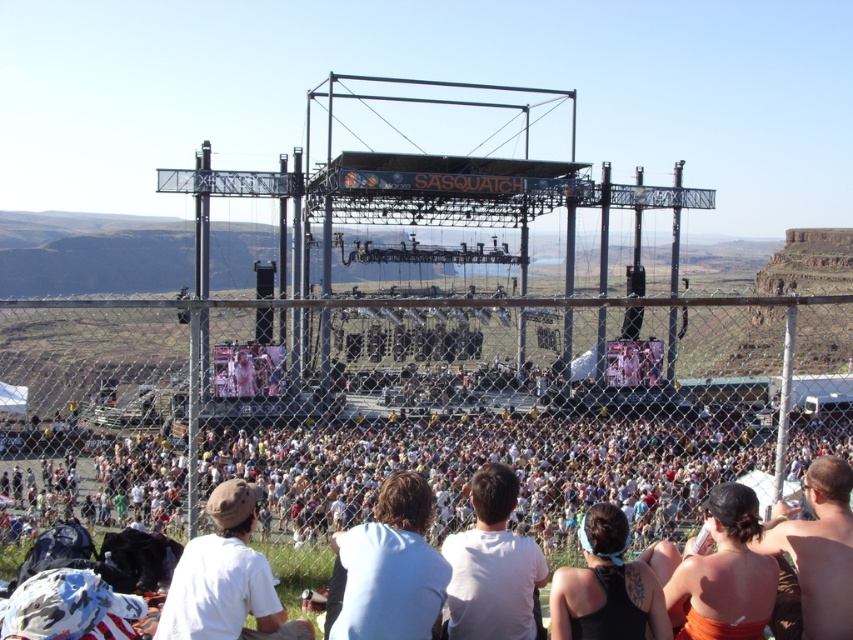
Is white cotton shirt at lower center further to the viewer compared to white matte shirt at center?

No, it is not.

Who is lower down, white cotton shirt at lower center or white matte shirt at center?

Positioned lower is white cotton shirt at lower center.

Identify the location of white cotton shirt at lower center. This screenshot has width=853, height=640. (225, 579).

Is white cotton crowd at lower center wider than skinny bikini top at lower right?

Yes.

Which is more to the left, white cotton crowd at lower center or skinny bikini top at lower right?

Positioned to the left is white cotton crowd at lower center.

Which is behind, point (637, 435) or point (804, 520)?

The point (637, 435) is more distant.

You are a GUI agent. You are given a task and a screenshot of the screen. Output one action in this format:
    pyautogui.click(x=<x>, y=<y>)
    Task: Click on the white cotton crowd at lower center
    
    Given the screenshot: What is the action you would take?
    pyautogui.click(x=486, y=461)

Between white cotton shirt at lower center and skinny bikini top at lower right, which one appears on the right side from the viewer's perspective?

skinny bikini top at lower right is more to the right.

Can you confirm if white cotton shirt at lower center is positioned above skinny bikini top at lower right?

Actually, white cotton shirt at lower center is below skinny bikini top at lower right.

Where is `white cotton shirt at lower center`? The height and width of the screenshot is (640, 853). white cotton shirt at lower center is located at coordinates (225, 579).

At what (x,y) coordinates should I click in order to perform the action: click on white cotton shirt at lower center. Please return your answer as a coordinate pair (x, y). The height and width of the screenshot is (640, 853). Looking at the image, I should click on (225, 579).